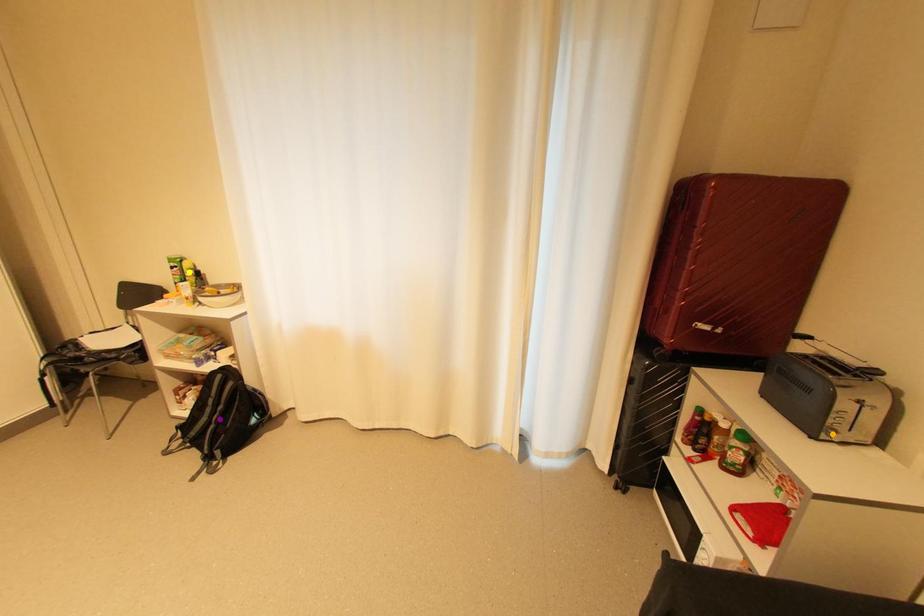
Order these from nearest to farthest:
orange point
yellow point
purple point

orange point < purple point < yellow point